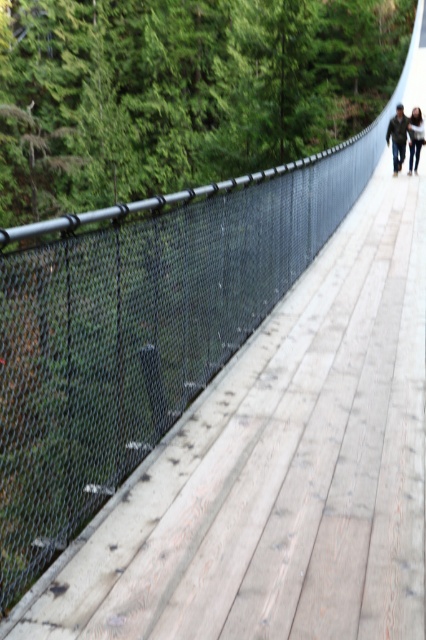
You are a hiker who wants to place both the blurred denim jacket at upper center and the light brown leather jacket at upper center on a single backpack hook. The hook can only hold one item at a time. Which jacket should you hang first to ensure both fit on the hook without overlapping?

The blurred denim jacket at upper center is larger in size than the light brown leather jacket at upper center. To ensure both fit without overlapping, you should hang the larger blurred denim jacket at upper center first, then the smaller light brown leather jacket at upper center on top of it.